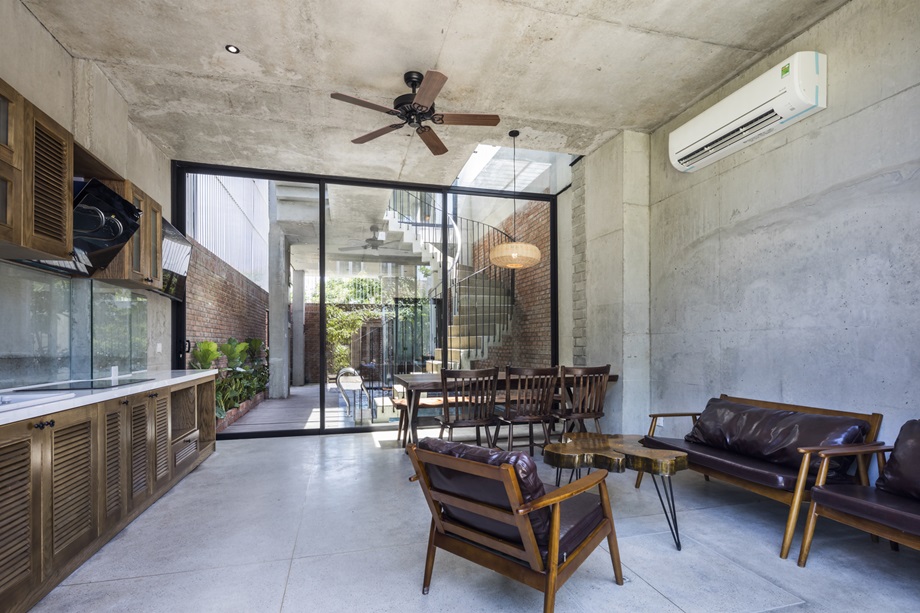
Where is `chair cushions`? chair cushions is located at coordinates (485, 490), (569, 520), (880, 496), (909, 470).